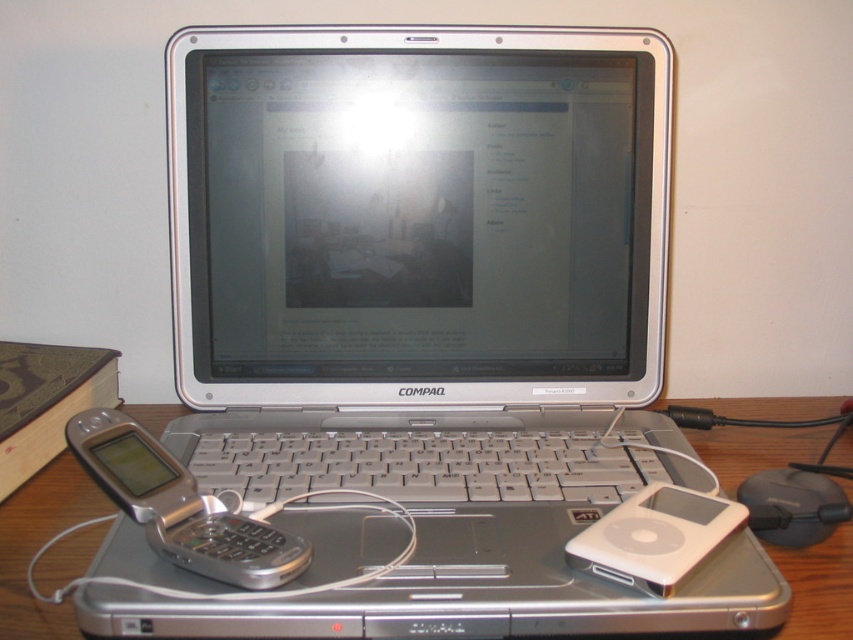
You are organizing a tech exhibit and need to place the silver metallic phone at lower left and the white plastic ipod at lower right into a display case. The case has a height limit of 10 cm. Which device might not fit if the tallest object is exactly 10 cm?

The silver metallic phone at lower left is taller than the white plastic ipod at lower right. If the tallest object is exactly 10 cm, the silver metallic phone at lower left might not fit within the display case height limit of 10 cm.

What are the coordinates of the white plastic ipod at lower right?

The white plastic ipod at lower right is located at coordinates point [654,536].

You are organizing the desk and want to place the silver metallic phone at lower left and the white plastic ipod at lower right in a straight line. Which device should you move to align them properly?

The silver metallic phone at lower left is already positioned to the left of white plastic ipod at lower right, so they are already aligned in a straight line from left to right.